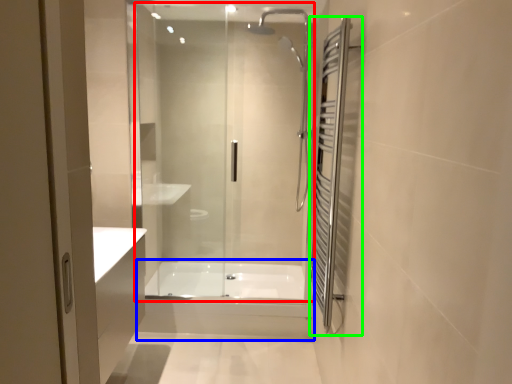
Question: Which is nearer to the shower door (highlighted by a red box)? bath (highlighted by a blue box) or screen door (highlighted by a green box).

Choices:
 (A) bath
 (B) screen door

Answer: (B)